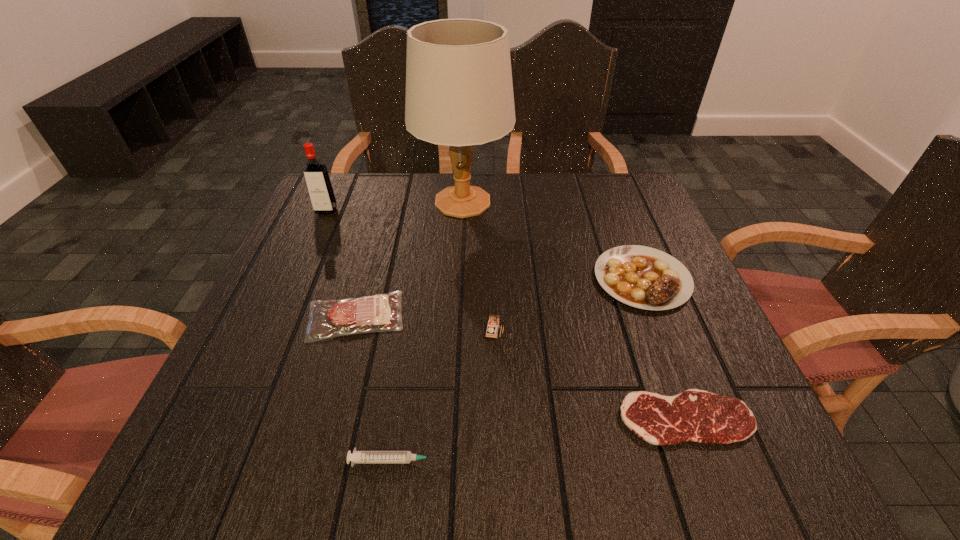
The image size is (960, 540). Find the location of `vacant space located 0.250m on the front and back of the leftmost object`. vacant space located 0.250m on the front and back of the leftmost object is located at coordinates (295, 280).

What are the coordinates of `vacant space located on the left of the matchbox` in the screenshot? It's located at (320, 327).

Find the location of `vacant space located 0.160m on the front of the fourth tallest object`. vacant space located 0.160m on the front of the fourth tallest object is located at coordinates [682, 380].

The height and width of the screenshot is (540, 960). Identify the location of free point located 0.050m on the right of the leftmost steak. (430, 316).

Where is `free space located 0.320m at the needle end of the syringe`? The image size is (960, 540). free space located 0.320m at the needle end of the syringe is located at coordinates (650, 461).

What are the coordinates of `vacant space located 0.110m on the left of the nearest steak` in the screenshot? It's located at (554, 418).

In order to click on table lamp that is at the far edge in this screenshot , I will do [459, 92].

Identify the location of vodka positioned at the far edge. The height and width of the screenshot is (540, 960). (317, 179).

Where is `syringe positioned at the near edge`? The width and height of the screenshot is (960, 540). syringe positioned at the near edge is located at coordinates (358, 457).

Locate an element on the screen. The width and height of the screenshot is (960, 540). steak located in the near edge section of the desktop is located at coordinates (695, 415).